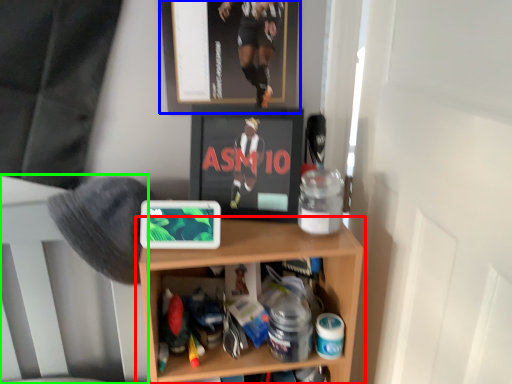
Question: Based on their relative distances, which object is farther from shelf (highlighted by a red box)? Choose from picture frame (highlighted by a blue box) and bed frame (highlighted by a green box).

Choices:
 (A) picture frame
 (B) bed frame

Answer: (A)